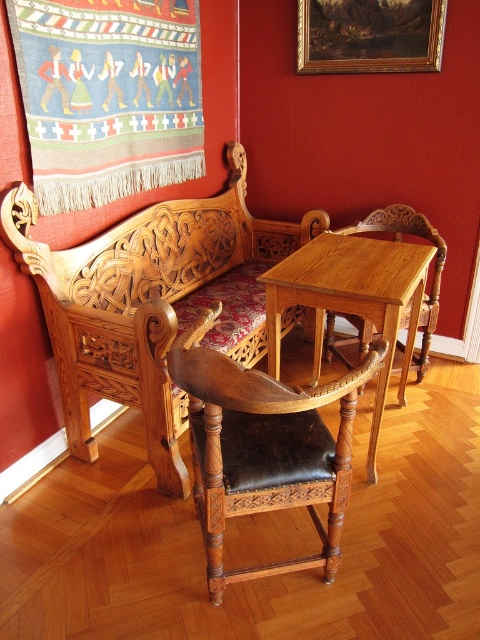
Question: Can you confirm if dark brown leather chair at center is positioned to the right of gold-framed painting at upper center?

Choices:
 (A) yes
 (B) no

Answer: (B)

Question: Which object appears closest to the camera in this image?

Choices:
 (A) wooden armchair at center
 (B) light brown wood table at center
 (C) polished wood armchair at center
 (D) gold-framed painting at upper center

Answer: (B)

Question: Which point appears farthest from the camera in this image?

Choices:
 (A) (276, 221)
 (B) (186, 44)

Answer: (A)

Question: Which of the following is the closest to the observer?

Choices:
 (A) gold-framed painting at upper center
 (B) light brown wood table at center

Answer: (B)

Question: Does dark brown leather chair at center appear on the left side of gold-framed painting at upper center?

Choices:
 (A) yes
 (B) no

Answer: (A)

Question: Can you confirm if gold-framed painting at upper center is smaller than wooden armchair at center?

Choices:
 (A) yes
 (B) no

Answer: (A)